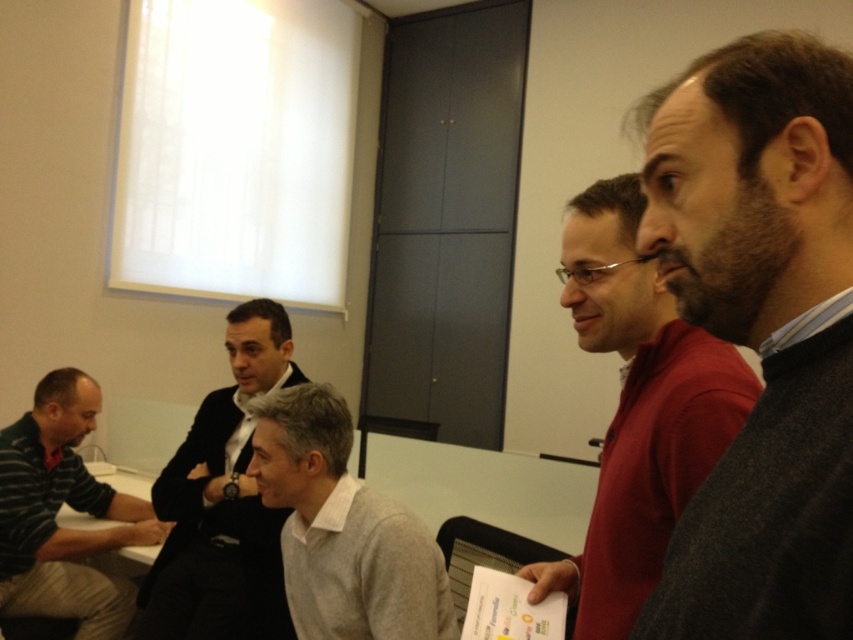
Does matte red sweater at center have a larger size compared to striped cotton shirt at left?

Incorrect, matte red sweater at center is not larger than striped cotton shirt at left.

Can you confirm if matte red sweater at center is thinner than striped cotton shirt at left?

Yes, matte red sweater at center is thinner than striped cotton shirt at left.

Which is in front, point (663, 417) or point (70, 602)?

Point (663, 417) is in front.

I want to click on matte red sweater at center, so click(x=637, y=410).

Which of these two, matte red sweater at center or dark gray suit at center, stands taller?

dark gray suit at center

Between matte red sweater at center and dark gray suit at center, which one is positioned higher?

matte red sweater at center is higher up.

The height and width of the screenshot is (640, 853). What do you see at coordinates (637, 410) in the screenshot?
I see `matte red sweater at center` at bounding box center [637, 410].

This screenshot has width=853, height=640. What are the coordinates of `matte red sweater at center` in the screenshot? It's located at (637, 410).

Is point (815, 531) positioned after point (706, 388)?

No.

Between dark gray sweater at right and matte red sweater at center, which one is positioned lower?

matte red sweater at center

Find the location of a particular element. This screenshot has height=640, width=853. dark gray sweater at right is located at coordinates pyautogui.click(x=761, y=332).